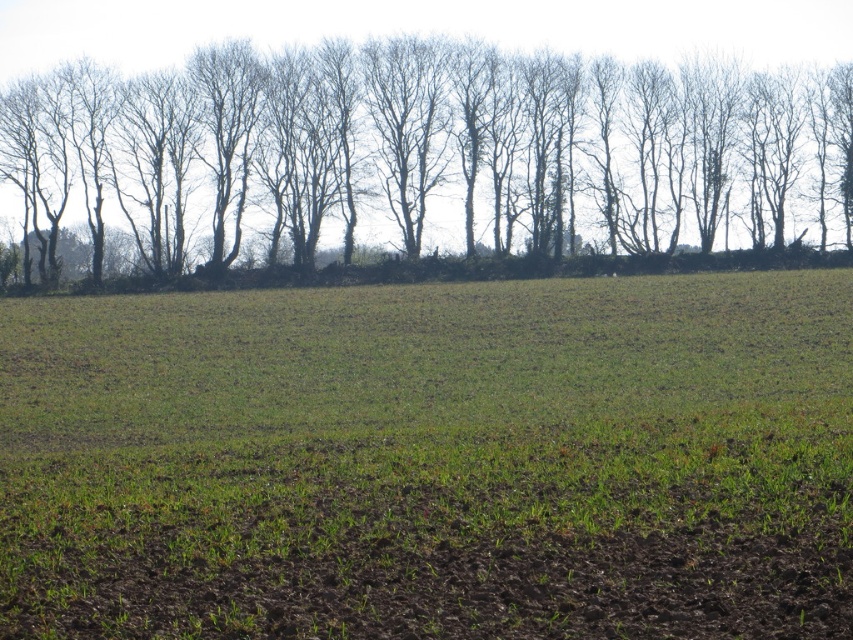
Who is positioned more to the left, green grassy field at center or bare branches at upper center?

green grassy field at center

From the picture: Between green grassy field at center and bare branches at upper center, which one is positioned higher?

Positioned higher is bare branches at upper center.

What do you see at coordinates (431, 460) in the screenshot? I see `green grassy field at center` at bounding box center [431, 460].

Find the location of a particular element. Image resolution: width=853 pixels, height=640 pixels. green grassy field at center is located at coordinates (431, 460).